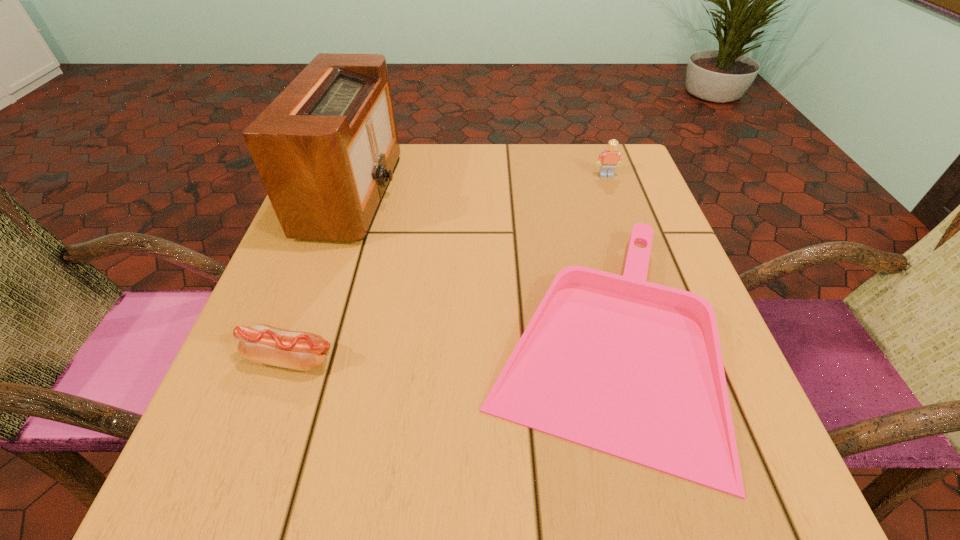
This screenshot has width=960, height=540. I want to click on radio receiver positioned at the far edge, so click(x=326, y=148).

I want to click on Lego at the far edge, so click(x=608, y=159).

Where is `object that is at the near edge`? object that is at the near edge is located at coordinates (634, 369).

Locate an element on the screen. radio receiver present at the left edge is located at coordinates pyautogui.click(x=326, y=148).

Where is `sausage that is at the left edge`? The width and height of the screenshot is (960, 540). sausage that is at the left edge is located at coordinates pyautogui.click(x=260, y=343).

Locate an element on the screen. The image size is (960, 540). Lego present at the right edge is located at coordinates (608, 159).

Locate an element on the screen. dustpan that is positioned at the right edge is located at coordinates (634, 369).

This screenshot has height=540, width=960. What are the coordinates of `object present at the far left corner` in the screenshot? It's located at (326, 148).

Where is `object at the far right corner`? object at the far right corner is located at coordinates (608, 159).

Where is `object present at the near right corner`? object present at the near right corner is located at coordinates (634, 369).